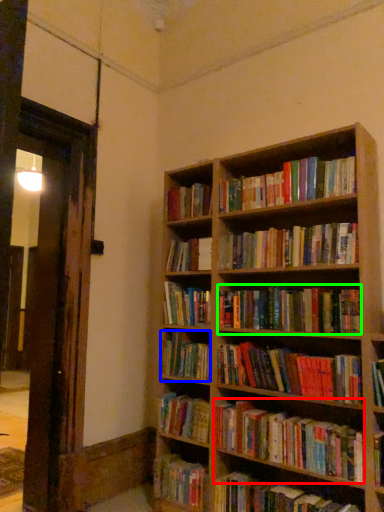
Question: Estimate the real-world distances between objects in this image. Which object is farther from book (highlighted by a red box), book (highlighted by a blue box) or book (highlighted by a green box)?

Choices:
 (A) book
 (B) book

Answer: (B)